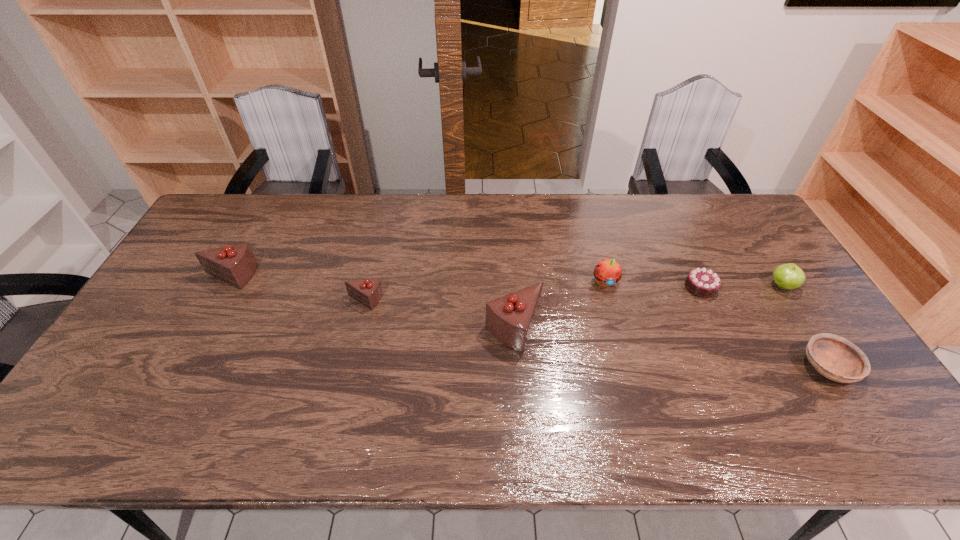
The width and height of the screenshot is (960, 540). I want to click on the third shortest chocolate cake, so click(235, 265).

The height and width of the screenshot is (540, 960). I want to click on the leftmost object, so click(235, 265).

The image size is (960, 540). Find the location of `the second shortest chocolate cake`. the second shortest chocolate cake is located at coordinates coord(368,292).

The height and width of the screenshot is (540, 960). In order to click on the second object from left to right in this screenshot , I will do `click(368, 292)`.

Image resolution: width=960 pixels, height=540 pixels. What are the coordinates of `the third chocolate cake from left to right` in the screenshot? It's located at click(510, 318).

The image size is (960, 540). I want to click on the fifth object from left to right, so pos(701,282).

Identify the location of the shortest chocolate cake. This screenshot has height=540, width=960. (701, 282).

The width and height of the screenshot is (960, 540). Find the location of `bowl`. bowl is located at coordinates 836,358.

Where is `the left apple`? Image resolution: width=960 pixels, height=540 pixels. the left apple is located at coordinates pyautogui.click(x=607, y=272).

Where is `the right apple`? the right apple is located at coordinates (789, 276).